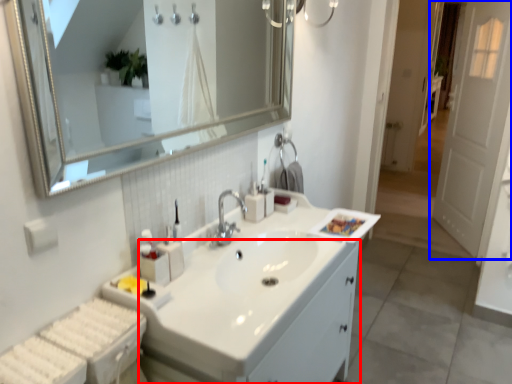
Question: Among these objects, which one is nearest to the camera, bathroom cabinet (highlighted by a red box) or door (highlighted by a blue box)?

Choices:
 (A) bathroom cabinet
 (B) door

Answer: (A)